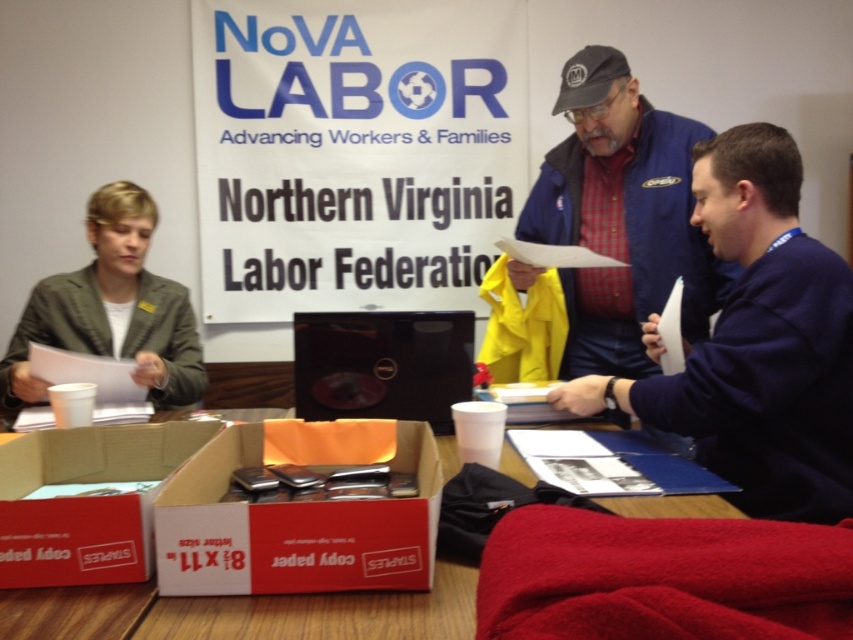
You are organizing materials at a Northern Virginia Labor Federation event. You have a white cardboard box at lower center and a green fabric jacket at left. Which object takes up more space?

The green fabric jacket at left takes up more space because it is larger than the white cardboard box at lower center.

You are organizing materials for the NoVA LABOR event and need to stack the white cardboard box at center and the white cardboard box at lower left. Which box should you place on top to ensure stability?

You should place the white cardboard box at center on top of the white cardboard box at lower left because the white cardboard box at center is smaller than the white cardboard box at lower left, making it more stable.

You are organizing materials for the NoVA Labor event and need to place the dark blue sweater at center and the white cardboard box at lower center on a shelf. According to the image, which object should be placed to the right of the other?

The dark blue sweater at center is positioned on the right side of white cardboard box at lower center, so the dark blue sweater at center should be placed to the right of the white cardboard box at lower center.